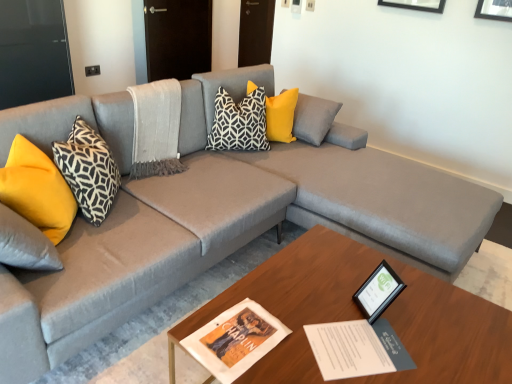
The width and height of the screenshot is (512, 384). Find the location of `free area in between black glossy picture frame at lower right and white paper booklet at center`. free area in between black glossy picture frame at lower right and white paper booklet at center is located at coordinates (345, 314).